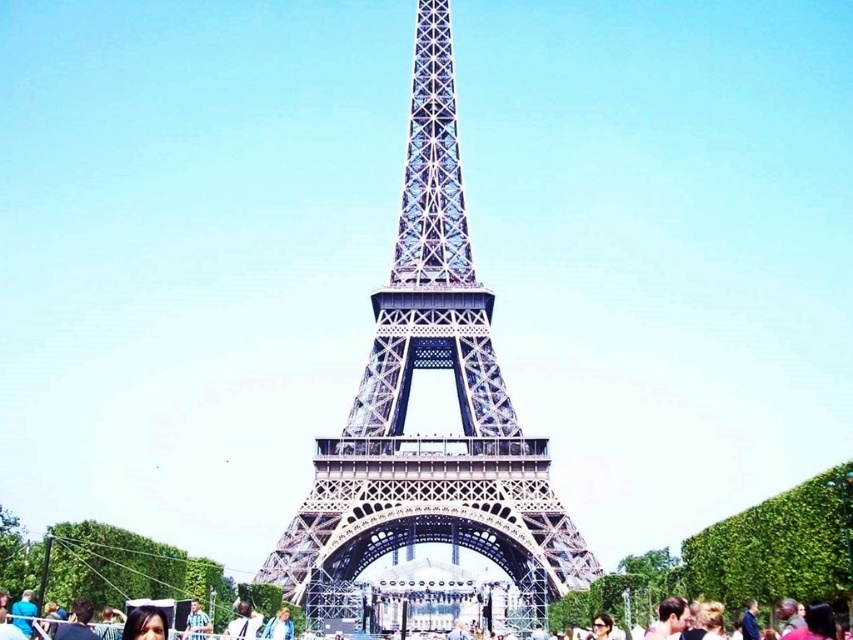
Between point (421, 256) and point (86, 616), which one is positioned in front?

Positioned in front is point (86, 616).

Between metallic blue tower at center and matte black crowd at lower center, which one is positioned higher?

Positioned higher is metallic blue tower at center.

Measure the distance between point (486, 353) and camera.

Point (486, 353) and camera are 109.13 meters apart from each other.

Find the location of a particular element. metallic blue tower at center is located at coordinates (408, 396).